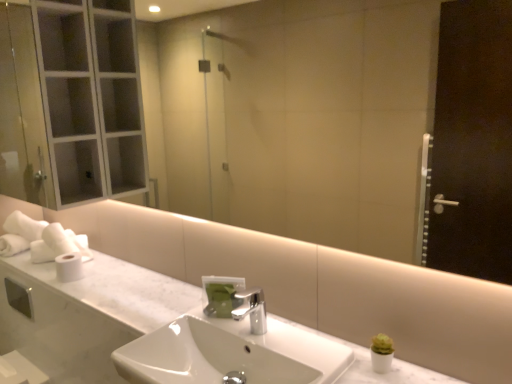
The width and height of the screenshot is (512, 384). In order to click on vacant space that is in between white matte toilet paper at left, which ranks as the 1th toilet paper in front-to-back order, and white matte toilet paper at left, the first toilet paper from the back in this screenshot , I will do `click(50, 269)`.